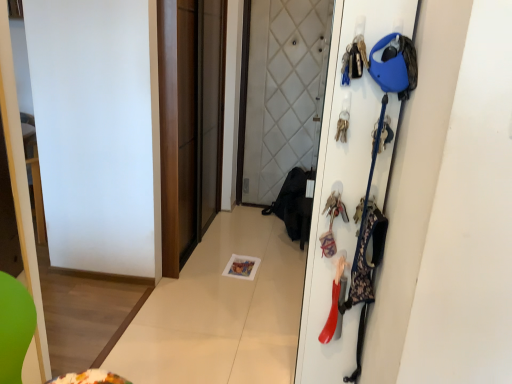
Identify the location of vacant space in brown matte sliding door at center (from a real-world perspective). (198, 243).